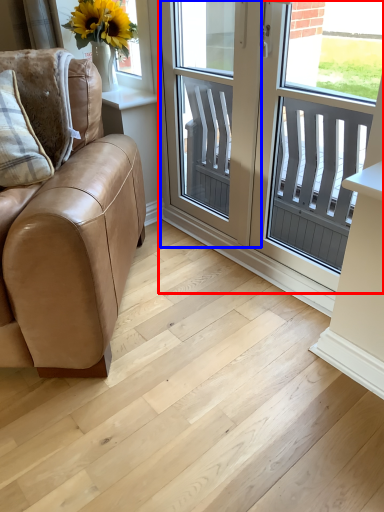
Question: Which of the following is the closest to the observer, window (highlighted by a red box) or screen door (highlighted by a blue box)?

Choices:
 (A) window
 (B) screen door

Answer: (A)